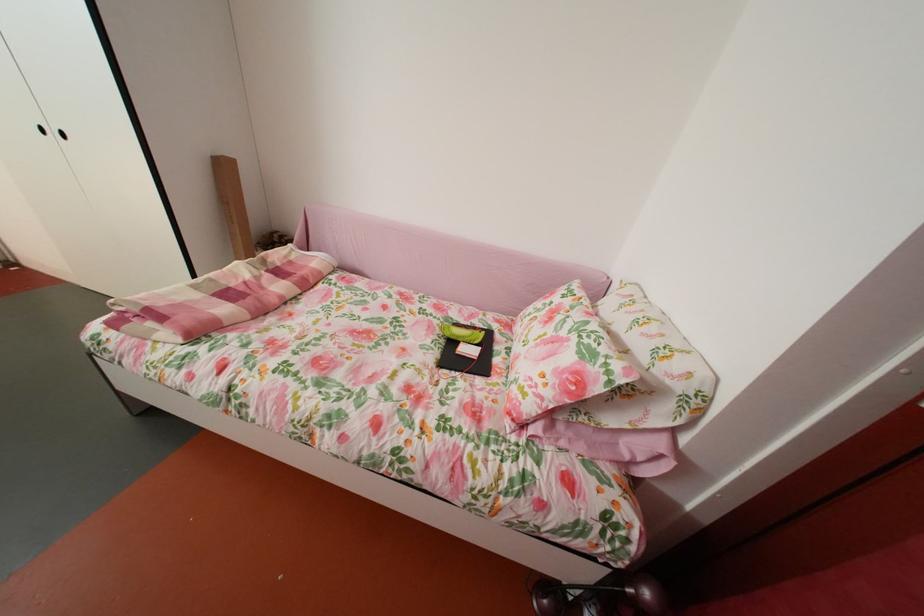
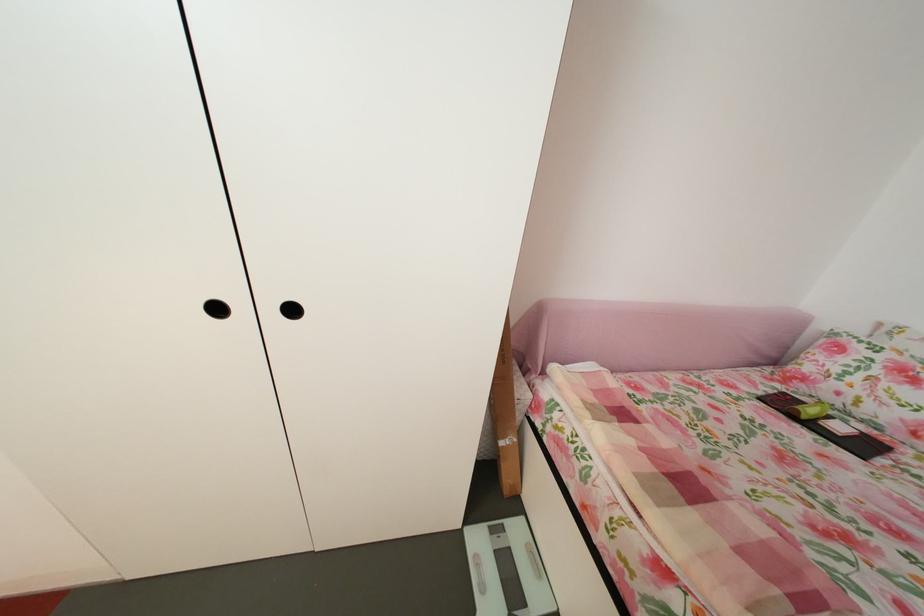
Question: What movement of the cameraman would produce the second image?

Choices:
 (A) Left
 (B) Right
 (C) Forward
 (D) Backward

Answer: (A)